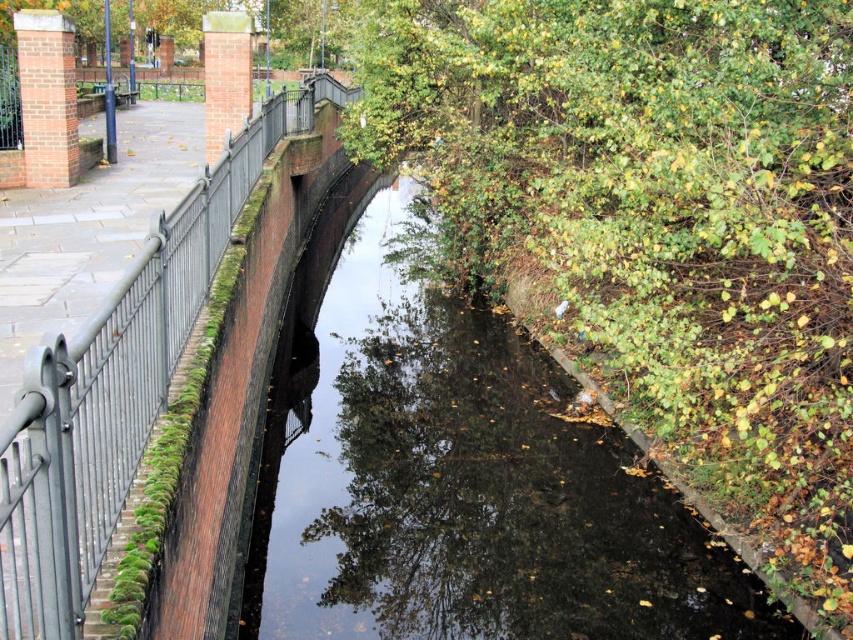
Question: Which point is farther to the camera?

Choices:
 (A) green leafy tree at upper right
 (B) metallic gray fence at left

Answer: (A)

Question: Is green leafy tree at upper right to the right of metallic gray fence at left from the viewer's perspective?

Choices:
 (A) no
 (B) yes

Answer: (B)

Question: Is green leafy tree at upper right positioned at the back of metallic gray fence at left?

Choices:
 (A) yes
 (B) no

Answer: (A)

Question: Which of the following is the closest to the observer?

Choices:
 (A) (177, 346)
 (B) (787, 152)

Answer: (A)

Question: Considering the relative positions of green leafy tree at upper right and metallic gray fence at left in the image provided, where is green leafy tree at upper right located with respect to metallic gray fence at left?

Choices:
 (A) above
 (B) below

Answer: (B)